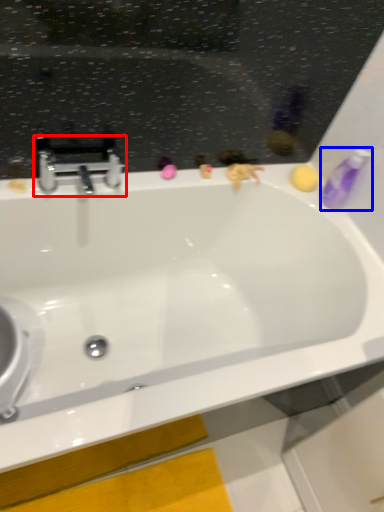
Question: Which point is further to the camera, tap (highlighted by a red box) or toiletry (highlighted by a blue box)?

Choices:
 (A) tap
 (B) toiletry

Answer: (B)